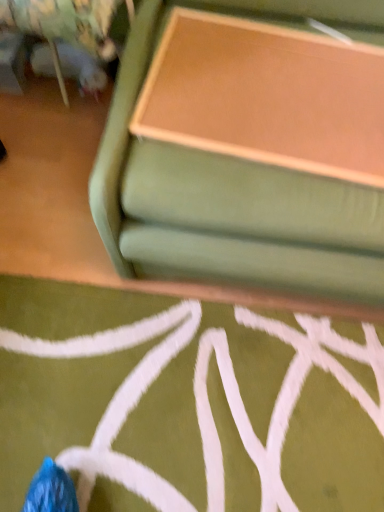
The height and width of the screenshot is (512, 384). Describe the element at coordinates (233, 189) in the screenshot. I see `green fabric couch at upper center` at that location.

The image size is (384, 512). In order to click on green fabric couch at upper center in this screenshot , I will do tap(233, 189).

The width and height of the screenshot is (384, 512). I want to click on green fabric couch at upper center, so click(233, 189).